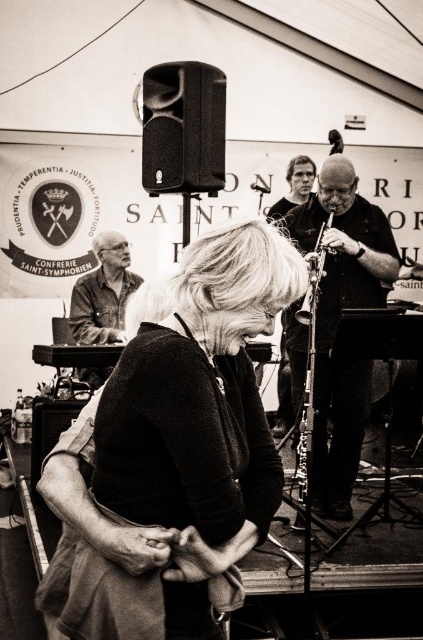
Does smooth black clarinet at center come in front of matte black shirt at left?

Yes.

Which is more to the left, smooth black clarinet at center or matte black shirt at left?

matte black shirt at left

The width and height of the screenshot is (423, 640). In order to click on smooth black clarinet at center in this screenshot , I will do `click(337, 321)`.

Locate an element on the screen. Image resolution: width=423 pixels, height=640 pixels. smooth black clarinet at center is located at coordinates (337, 321).

Who is lower down, matte black sweater at center or matte black shirt at left?

matte black sweater at center is lower down.

Between matte black sweater at center and matte black shirt at left, which one appears on the right side from the viewer's perspective?

Positioned to the right is matte black sweater at center.

Looking at this image, who is more distant from viewer, (85, 461) or (96, 314)?

Point (96, 314)

At what (x,y) coordinates should I click in order to perform the action: click on matte black sweater at center. Please return your answer as a coordinate pair (x, y). Looking at the image, I should click on (173, 451).

Is matte black sweater at center closer to camera compared to smooth black clarinet at center?

Yes, matte black sweater at center is closer to the viewer.

Which is behind, point (263, 225) or point (357, 259)?

Point (357, 259)

Who is more distant from viewer, (228, 444) or (332, 461)?

The point (332, 461) is more distant.

The image size is (423, 640). Find the location of `matte black sweater at center`. matte black sweater at center is located at coordinates (173, 451).